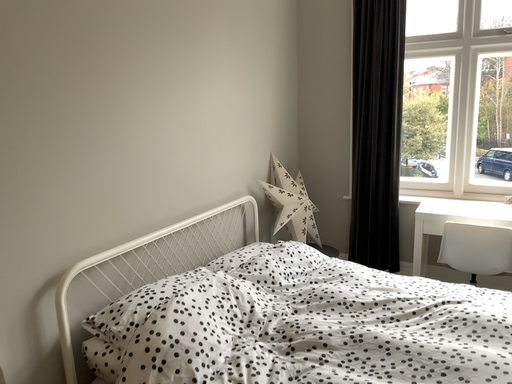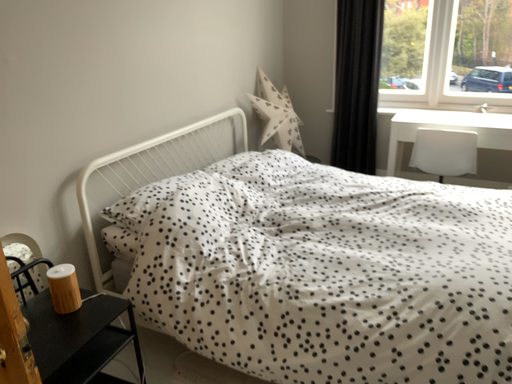
Question: Which way did the camera rotate in the video?

Choices:
 (A) rotated downward
 (B) rotated upward

Answer: (A)